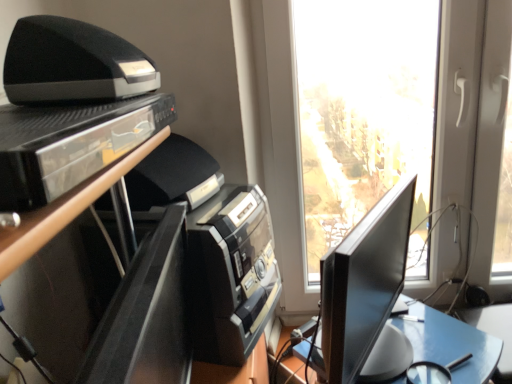
In order to face black glossy monitor at right, should I rotate leftwards or rightwards?

To align with it, rotate right about 14.866°.

Where is `black glossy entertainment center at left`? Image resolution: width=512 pixels, height=384 pixels. black glossy entertainment center at left is located at coordinates (138, 208).

Consider the image. Is black plastic printer at upper left positioned far away from black glossy monitor at right?

No, there isn't a large distance between black plastic printer at upper left and black glossy monitor at right.

Considering the relative positions of black plastic printer at upper left and black glossy monitor at right in the image provided, is black plastic printer at upper left to the left or to the right of black glossy monitor at right?

Clearly, black plastic printer at upper left is on the left of black glossy monitor at right in the image.

From a real-world perspective, who is located higher, black plastic printer at upper left or black glossy monitor at right?

From a 3D spatial view, black plastic printer at upper left is above.

Between black plastic printer at upper left and black glossy shelf at upper left, which one has larger width?

black glossy shelf at upper left is wider.

Between black plastic printer at upper left and black glossy shelf at upper left, which one appears on the left side from the viewer's perspective?

From the viewer's perspective, black glossy shelf at upper left appears more on the left side.

Is black plastic printer at upper left directly adjacent to black glossy shelf at upper left?

black plastic printer at upper left is not next to black glossy shelf at upper left, and they're not touching.

Is point (47, 32) in front of point (18, 67)?

Yes, it is.

Looking at this image, what's the angular difference between black glossy entertainment center at left and black plastic printer at upper left's facing directions?

15.9 degrees separate the facing orientations of black glossy entertainment center at left and black plastic printer at upper left.

From the image's perspective, does black glossy entertainment center at left appear higher than black plastic printer at upper left?

No, from the image's perspective, black glossy entertainment center at left is not over black plastic printer at upper left.

Considering the sizes of objects black glossy entertainment center at left and black plastic printer at upper left in the image provided, who is shorter, black glossy entertainment center at left or black plastic printer at upper left?

Standing shorter between the two is black plastic printer at upper left.

Consider the image. What's the angular difference between black glossy entertainment center at left and black glossy monitor at right's facing directions?

The facing directions of black glossy entertainment center at left and black glossy monitor at right are 15.1 degrees apart.

Which is nearer, (183,345) or (330,338)?

The point (183,345) is closer to the camera.

From the image's perspective, is black glossy entertainment center at left located beneath black glossy monitor at right?

No, from the image's perspective, black glossy entertainment center at left is not below black glossy monitor at right.

Is black glossy entertainment center at left to the left or to the right of black glossy monitor at right in the image?

black glossy entertainment center at left is positioned on black glossy monitor at right's left side.

Does black glossy monitor at right have a greater height compared to black glossy shelf at upper left?

Correct, black glossy monitor at right is much taller as black glossy shelf at upper left.

In the scene shown: Is black glossy monitor at right wider than black glossy shelf at upper left?

No, black glossy monitor at right is not wider than black glossy shelf at upper left.

From the image's perspective, is black glossy monitor at right positioned above or below black glossy shelf at upper left?

From the image's perspective, black glossy monitor at right appears below black glossy shelf at upper left.

Could you tell me if black glossy monitor at right is turned towards black glossy shelf at upper left?

No, black glossy monitor at right is not facing towards black glossy shelf at upper left.

From the image's perspective, is black glossy monitor at right above black glossy entertainment center at left?

No, from the image's perspective, black glossy monitor at right is not over black glossy entertainment center at left.

Is black glossy monitor at right not inside black glossy entertainment center at left?

Indeed, black glossy monitor at right is completely outside black glossy entertainment center at left.

Which object is wider, black glossy monitor at right or black glossy entertainment center at left?

Wider between the two is black glossy entertainment center at left.

How far apart are black plastic printer at upper left and black glossy entertainment center at left?

black plastic printer at upper left and black glossy entertainment center at left are 21.25 centimeters apart from each other.

Who is shorter, black plastic printer at upper left or black glossy entertainment center at left?

black plastic printer at upper left is shorter.

Is there a large distance between black plastic printer at upper left and black glossy entertainment center at left?

No, black plastic printer at upper left is not far from black glossy entertainment center at left.

Could you tell me if black plastic printer at upper left is facing black glossy entertainment center at left?

No, black plastic printer at upper left is not aimed at black glossy entertainment center at left.

Identify the location of printer in front of the black glossy monitor at right. (73, 63).

Where is `shelf beneath the black plastic printer at upper left (from a real-world perspective)`? The image size is (512, 384). shelf beneath the black plastic printer at upper left (from a real-world perspective) is located at coordinates (70, 144).

Looking at the image, which one is located closer to black glossy entertainment center at left, black glossy monitor at right or black glossy shelf at upper left?

black glossy shelf at upper left is positioned closer to the anchor black glossy entertainment center at left.

From the picture: When comparing their distances from black plastic printer at upper left, does black glossy entertainment center at left or black glossy monitor at right seem closer?

black glossy entertainment center at left.

From the image, which object appears to be nearer to black plastic printer at upper left, black glossy shelf at upper left or black glossy monitor at right?

The object closer to black plastic printer at upper left is black glossy shelf at upper left.

In the scene shown: Looking at the image, which one is located closer to black glossy entertainment center at left, black plastic printer at upper left or black glossy shelf at upper left?

black glossy shelf at upper left is closer to black glossy entertainment center at left.

Considering their positions, is black plastic printer at upper left positioned closer to black glossy shelf at upper left than black glossy entertainment center at left?

black plastic printer at upper left is positioned closer to the anchor black glossy shelf at upper left.

Estimate the real-world distances between objects in this image. Which object is closer to black plastic printer at upper left, black glossy shelf at upper left or black glossy entertainment center at left?

black glossy shelf at upper left is closer to black plastic printer at upper left.

Considering their positions, is black glossy monitor at right positioned closer to black glossy shelf at upper left than black plastic printer at upper left?

black plastic printer at upper left.

Based on their spatial positions, is black glossy monitor at right or black glossy entertainment center at left further from black glossy shelf at upper left?

black glossy monitor at right is positioned further to the anchor black glossy shelf at upper left.

Image resolution: width=512 pixels, height=384 pixels. I want to click on printer between black glossy shelf at upper left and black glossy entertainment center at left from front to back, so click(73, 63).

At what (x,y) coordinates should I click in order to perform the action: click on printer between black glossy shelf at upper left and black glossy monitor at right in the horizontal direction. Please return your answer as a coordinate pair (x, y). Image resolution: width=512 pixels, height=384 pixels. Looking at the image, I should click on (73, 63).

Where is `entertainment center situated between black glossy shelf at upper left and black glossy monitor at right from left to right`? entertainment center situated between black glossy shelf at upper left and black glossy monitor at right from left to right is located at coordinates (138, 208).

I want to click on entertainment center between black plastic printer at upper left and black glossy monitor at right, so click(x=138, y=208).